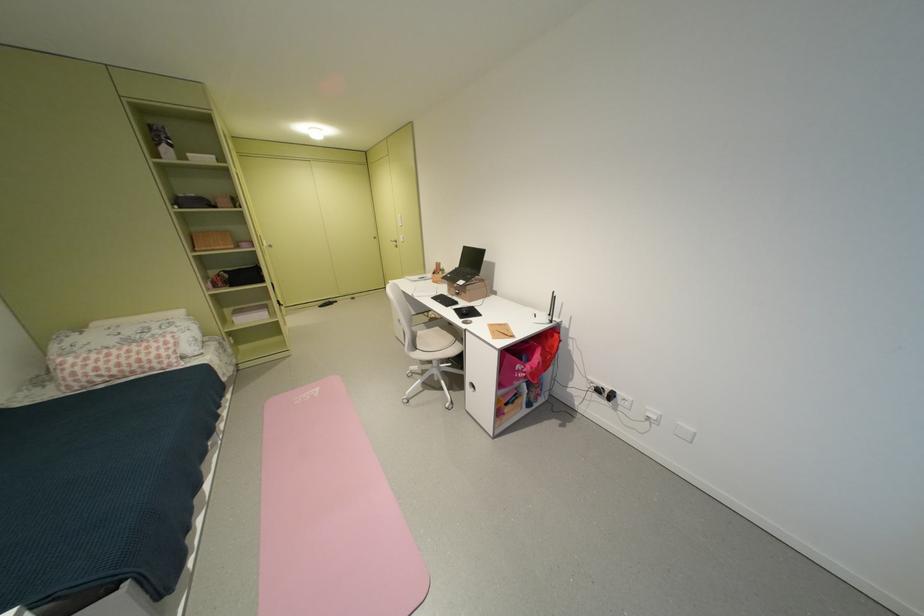
This screenshot has width=924, height=616. Describe the element at coordinates (390, 241) in the screenshot. I see `the metal door handle` at that location.